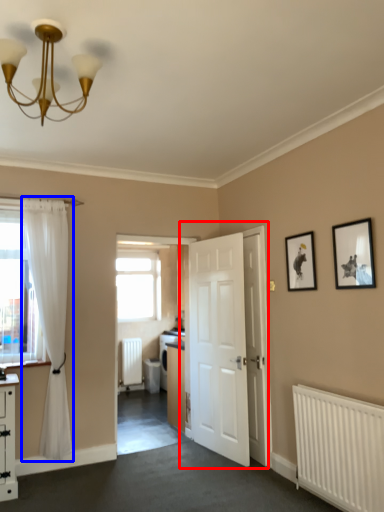
Question: Which of the following is the farthest to the observer, door (highlighted by a red box) or curtain (highlighted by a blue box)?

Choices:
 (A) door
 (B) curtain

Answer: (A)